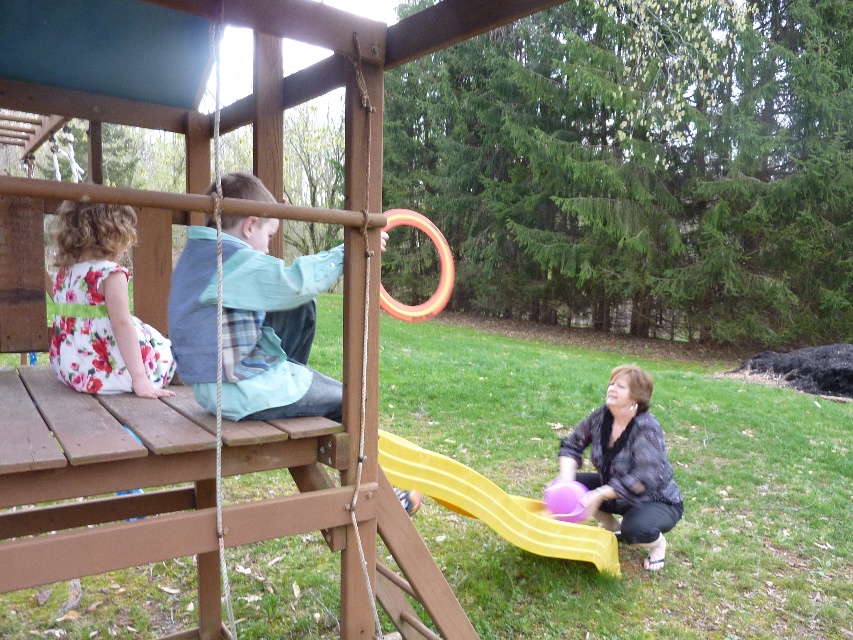
You are a parent supervising children at the playground. You notice the yellow plastic slide at lower center and the rubberized pink ball at lower center. Which object takes up more space in the image?

The yellow plastic slide at lower center is bigger than the rubberized pink ball at lower center, so it takes up more space in the image.

You are a parent at the playground and see the purple matte balloon at lower right and the yellow plastic slide at lower center. Which object is narrower in width?

The purple matte balloon at lower right is thinner than the yellow plastic slide at lower center, so the purple matte balloon at lower right is narrower in width.

In the scene shown: You are a parent at the playground and you want to ensure your child can easily reach both the floral cotton dress at left and the rubberized pink ball at lower center. Given that the child can reach items up to 1 meter tall, which item is more likely to be within their reach?

The rubberized pink ball at lower center is more likely to be within the child s reach since it is smaller in size compared to the floral cotton dress at left.